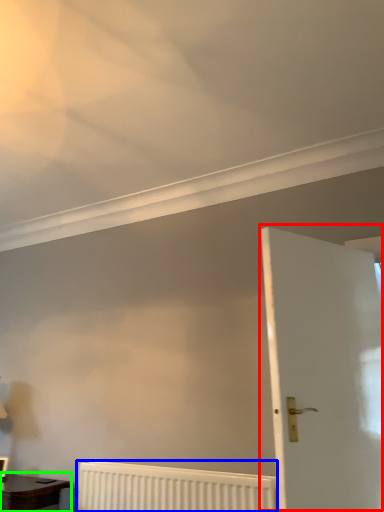
Question: Which object is positioned closest to door (highlighted by a red box)? Select from radiator (highlighted by a blue box) and table (highlighted by a green box).

Choices:
 (A) radiator
 (B) table

Answer: (A)